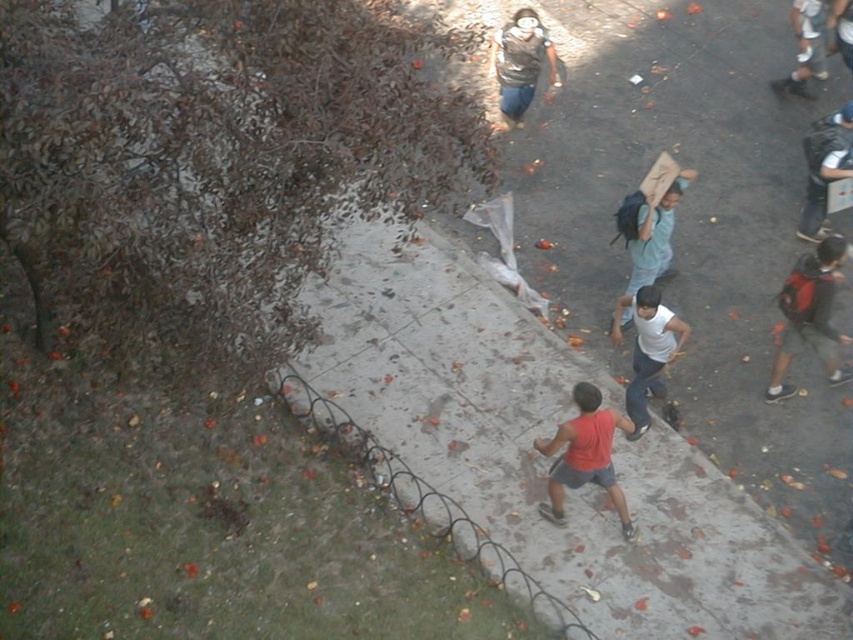
Does dark brown t-shirt at upper center have a lesser height compared to dark blue backpack at upper right?

No.

Is dark brown t-shirt at upper center to the right of dark blue backpack at upper right from the viewer's perspective?

Incorrect, dark brown t-shirt at upper center is not on the right side of dark blue backpack at upper right.

Which is in front, point (500, 106) or point (843, 12)?

Positioned in front is point (843, 12).

Image resolution: width=853 pixels, height=640 pixels. Identify the location of dark brown t-shirt at upper center. (520, 64).

From the picture: Between red backpack at right and light blue jeans at upper right, which one is positioned higher?

light blue jeans at upper right is above.

From the picture: Is red backpack at right to the right of light blue jeans at upper right from the viewer's perspective?

In fact, red backpack at right is to the left of light blue jeans at upper right.

Who is more distant from viewer, [796,340] or [817,12]?

Point [817,12]

Identify the location of red backpack at right. (810, 314).

Who is more distant from viewer, (799, 273) or (840, 115)?

Positioned behind is point (840, 115).

Does red backpack at right appear under dark blue backpack at right?

Correct, red backpack at right is located below dark blue backpack at right.

Which is behind, point (820, 275) or point (815, 204)?

Positioned behind is point (815, 204).

You are a GUI agent. You are given a task and a screenshot of the screen. Output one action in this format:
    pyautogui.click(x=<x>, y=<y>)
    Task: Click on the red backpack at right
    The width and height of the screenshot is (853, 640).
    Given the screenshot: What is the action you would take?
    pyautogui.click(x=810, y=314)